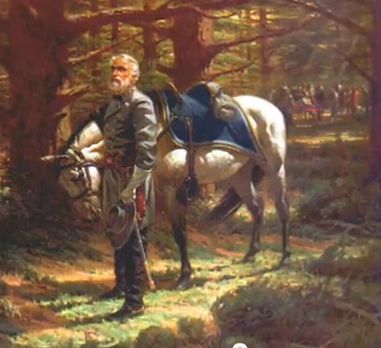
Where is `painting`? Image resolution: width=381 pixels, height=348 pixels. painting is located at coordinates (166, 282).